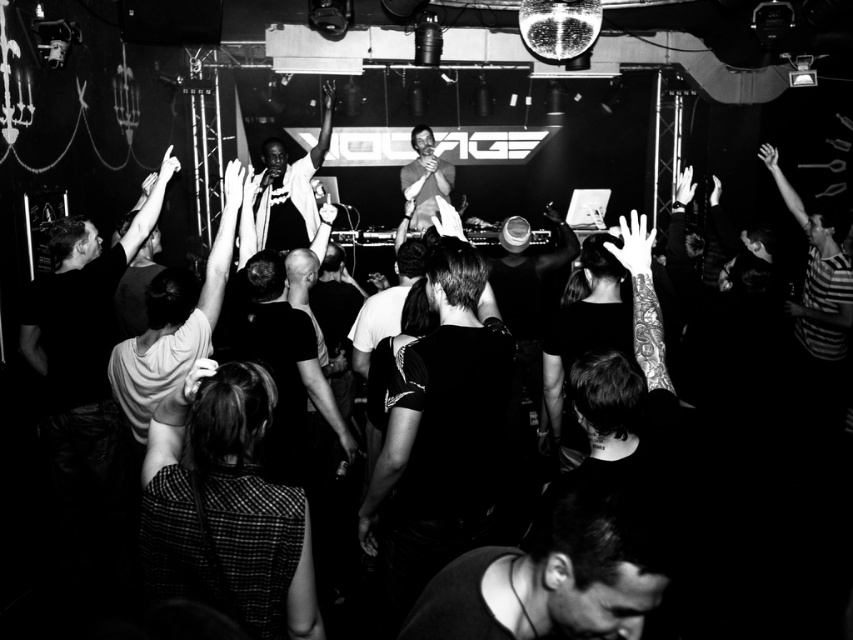
You are standing at the back of the venue and want to move closer to the stage. There are two points marked in the image. Which point, point [633,548] or point [412,209], is closer to the stage?

Point [633,548] is closer to the stage because it is in front of point [412,209].

You are a photographer at the event and want to capture a photo of the dark fabric shirt at lower center and smooth skin at center. Which object is positioned lower in the image?

The dark fabric shirt at lower center is positioned below smooth skin at center, so the dark fabric shirt at lower center is lower in the image.

You are a photographer at the concert venue and want to capture a closeup shot of the performer. Which object, the smooth black shirt at center or the smooth skin at center, would you focus on to ensure it takes up more of the frame?

The smooth skin at center occupies more space than the smooth black shirt at center, so focusing on the smooth skin at center would ensure it takes up more of the frame.